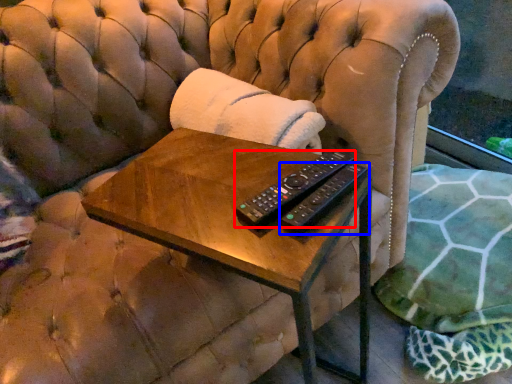
Question: Among these objects, which one is farthest to the camera, remote control (highlighted by a red box) or remote control (highlighted by a blue box)?

Choices:
 (A) remote control
 (B) remote control

Answer: (A)